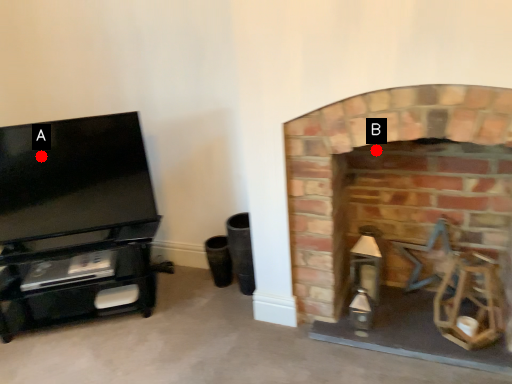
Question: Two points are circled on the image, labeled by A and B beside each circle. Which point is farther to the camera?

Choices:
 (A) A is further
 (B) B is further

Answer: (B)